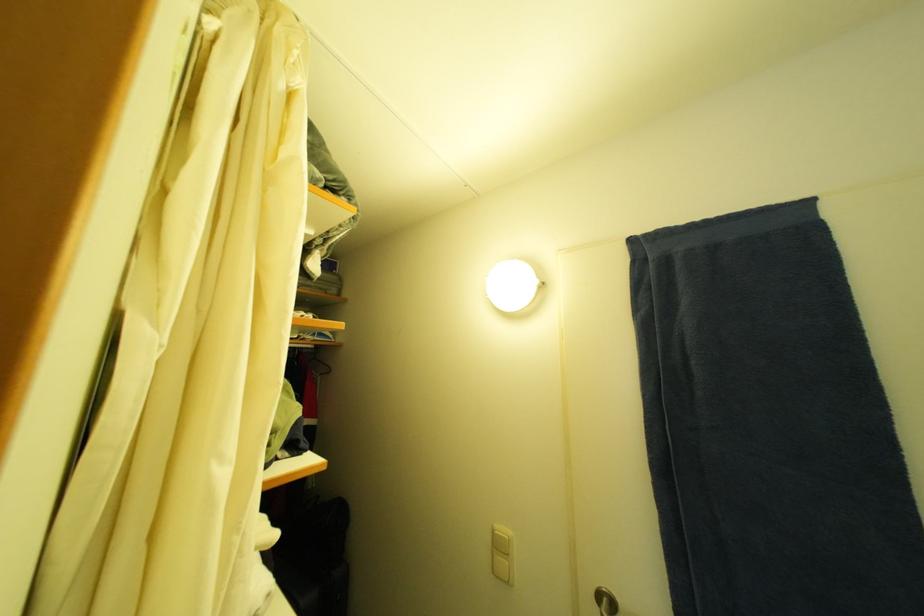
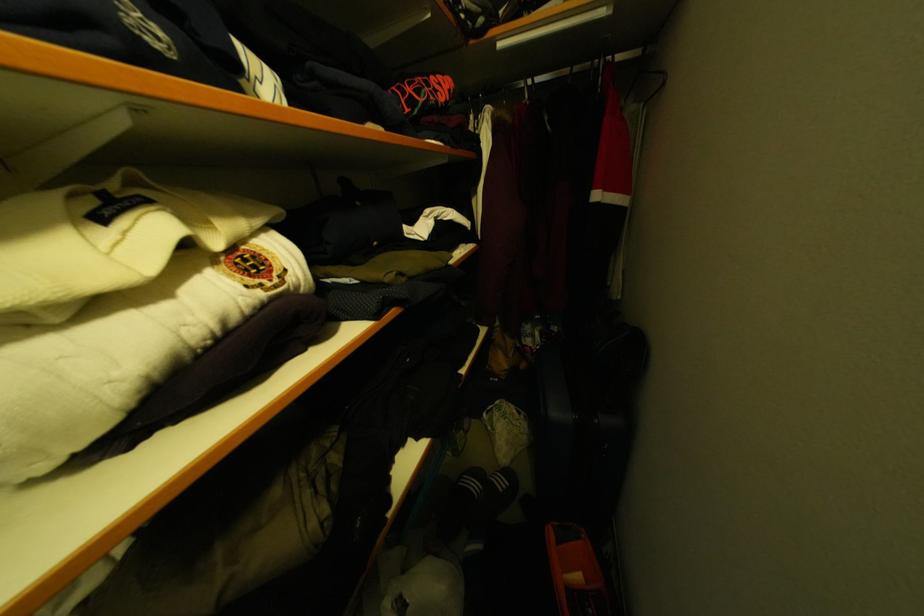
The first image is from the beginning of the video and the second image is from the end. How did the camera likely rotate when shooting the video?

The rotation direction of the camera is left-down.